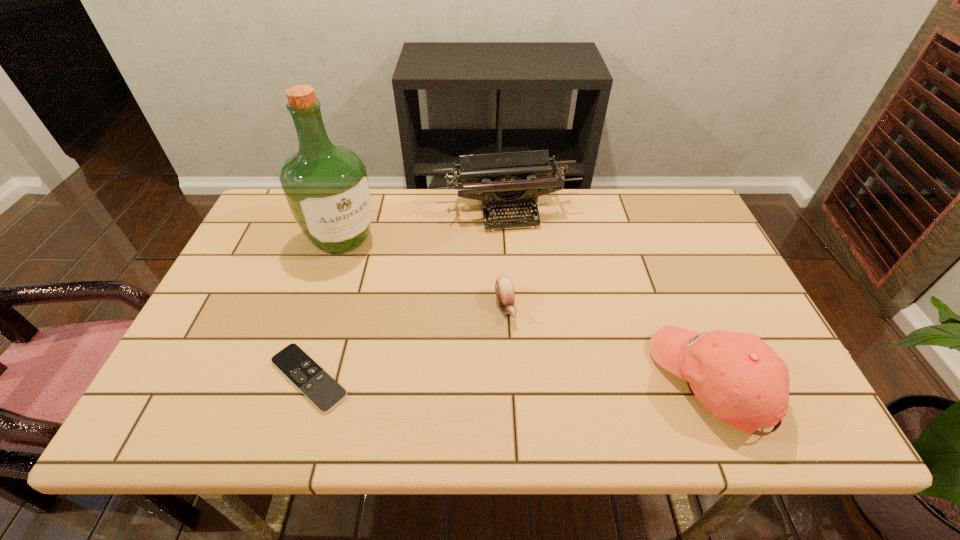
Where is `free location located 0.110m on the front-facing side of the liquor`? free location located 0.110m on the front-facing side of the liquor is located at coordinates (378, 281).

At what (x,y) coordinates should I click in order to perform the action: click on free region located on the front-facing side of the liquor. Please return your answer as a coordinate pair (x, y). The height and width of the screenshot is (540, 960). Looking at the image, I should click on (408, 316).

Where is `vacant space located on the front-facing side of the liquor`? The width and height of the screenshot is (960, 540). vacant space located on the front-facing side of the liquor is located at coordinates (380, 283).

At what (x,y) coordinates should I click in order to perform the action: click on vacant space located on the front-facing side of the fourth tallest object. Please return your answer as a coordinate pair (x, y). Looking at the image, I should click on (x=531, y=387).

This screenshot has height=540, width=960. Identify the location of vacant space located on the front-facing side of the fourth tallest object. (533, 392).

Where is `free space located 0.090m on the front-facing side of the fourth tallest object`? The image size is (960, 540). free space located 0.090m on the front-facing side of the fourth tallest object is located at coordinates (520, 357).

Where is `vacant region located on the typing side of the typewriter`? The width and height of the screenshot is (960, 540). vacant region located on the typing side of the typewriter is located at coordinates (519, 251).

At what (x,y) coordinates should I click in order to perform the action: click on vacant space located on the typing side of the typewriter. Please return your answer as a coordinate pair (x, y). The width and height of the screenshot is (960, 540). Looking at the image, I should click on (526, 279).

The image size is (960, 540). I want to click on vacant space situated on the typing side of the typewriter, so click(x=533, y=304).

Image resolution: width=960 pixels, height=540 pixels. What are the coordinates of `liquor that is at the far edge` in the screenshot? It's located at (327, 187).